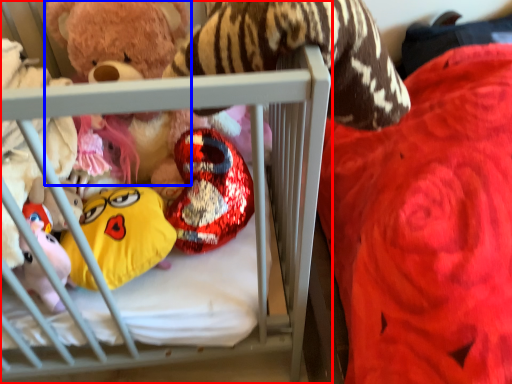
Question: Which point is further to the camera, infant bed (highlighted by a red box) or toy (highlighted by a blue box)?

Choices:
 (A) infant bed
 (B) toy

Answer: (B)